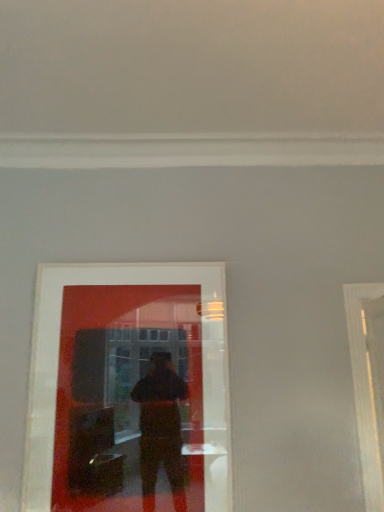
Measure the distance between white glossy door at right and camera.

white glossy door at right and camera are 2.14 meters apart from each other.

Identify the location of white glossy door at right. This screenshot has width=384, height=512. (368, 382).

Describe the element at coordinates (368, 382) in the screenshot. This screenshot has height=512, width=384. I see `white glossy door at right` at that location.

Where is `matte glass picture frame at center`? This screenshot has width=384, height=512. matte glass picture frame at center is located at coordinates (129, 390).

Describe the element at coordinates (129, 390) in the screenshot. This screenshot has width=384, height=512. I see `matte glass picture frame at center` at that location.

In order to face matte glass picture frame at center, should I rotate leftwards or rightwards?

To face it directly, rotate left by 8.172 degrees.

Measure the distance between point (144,328) and camera.

Point (144,328) is 7.52 feet away from camera.

This screenshot has height=512, width=384. Identify the location of white glossy door at right. (368, 382).

In the image, is white glossy door at right on the left side or the right side of matte glass picture frame at center?

white glossy door at right is positioned on matte glass picture frame at center's right side.

Relative to matte glass picture frame at center, is white glossy door at right in front or behind?

In the image, white glossy door at right appears in front of matte glass picture frame at center.

Does point (355, 386) lie behind point (153, 353)?

Yes, it is.

From the image's perspective, is white glossy door at right located above or below matte glass picture frame at center?

white glossy door at right is below matte glass picture frame at center.

From a real-world perspective, who is located higher, white glossy door at right or matte glass picture frame at center?

matte glass picture frame at center is physically above.

In terms of width, does white glossy door at right look wider or thinner when compared to matte glass picture frame at center?

Considering their sizes, white glossy door at right looks broader than matte glass picture frame at center.

Considering the relative sizes of white glossy door at right and matte glass picture frame at center in the image provided, is white glossy door at right taller than matte glass picture frame at center?

In fact, white glossy door at right may be shorter than matte glass picture frame at center.

Based on their sizes in the image, would you say white glossy door at right is bigger or smaller than matte glass picture frame at center?

Clearly, white glossy door at right is larger in size than matte glass picture frame at center.

Can matte glass picture frame at center be found inside white glossy door at right?

Definitely not — matte glass picture frame at center is not inside white glossy door at right.

Looking at this image, is white glossy door at right not close to matte glass picture frame at center?

Absolutely, white glossy door at right is distant from matte glass picture frame at center.

Is white glossy door at right positioned with its back to matte glass picture frame at center?

That's right, white glossy door at right is facing away from matte glass picture frame at center.

What's the angular difference between white glossy door at right and matte glass picture frame at center's facing directions?

They differ by 81.4 degrees in their facing directions.

How much distance is there between white glossy door at right and matte glass picture frame at center?

white glossy door at right and matte glass picture frame at center are 1.10 meters apart from each other.

You are a GUI agent. You are given a task and a screenshot of the screen. Output one action in this format:
    pyautogui.click(x=<x>, y=<y>)
    Task: Click on the picture frame located above the white glossy door at right (from the image's perspective)
    
    Given the screenshot: What is the action you would take?
    pyautogui.click(x=129, y=390)

Which is more to the right, matte glass picture frame at center or white glossy door at right?

Positioned to the right is white glossy door at right.

Is the position of matte glass picture frame at center less distant than that of white glossy door at right?

No, it is behind white glossy door at right.

Which is in front, point (126, 304) or point (374, 283)?

Positioned in front is point (126, 304).

From the image's perspective, would you say matte glass picture frame at center is shown under white glossy door at right?

No, from the image's perspective, matte glass picture frame at center is not beneath white glossy door at right.

From a real-world perspective, which is physically below, matte glass picture frame at center or white glossy door at right?

white glossy door at right.

Does matte glass picture frame at center have a lesser width compared to white glossy door at right?

Yes.

Between matte glass picture frame at center and white glossy door at right, which one has less height?

With less height is white glossy door at right.

Can you confirm if matte glass picture frame at center is bigger than white glossy door at right?

No.

Based on the photo, would you say matte glass picture frame at center is inside or outside white glossy door at right?

matte glass picture frame at center is spatially situated outside white glossy door at right.

Would you consider matte glass picture frame at center to be distant from white glossy door at right?

matte glass picture frame at center is far away from white glossy door at right.

Is matte glass picture frame at center positioned with its back to white glossy door at right?

No.

Find the location of `window frame below the matte glass picture frame at center (from a real-world perspective)`. window frame below the matte glass picture frame at center (from a real-world perspective) is located at coordinates (368, 382).

The height and width of the screenshot is (512, 384). Identify the location of picture frame behind the white glossy door at right. (129, 390).

Find the location of `window frame in front of the matte glass picture frame at center`. window frame in front of the matte glass picture frame at center is located at coordinates (368, 382).